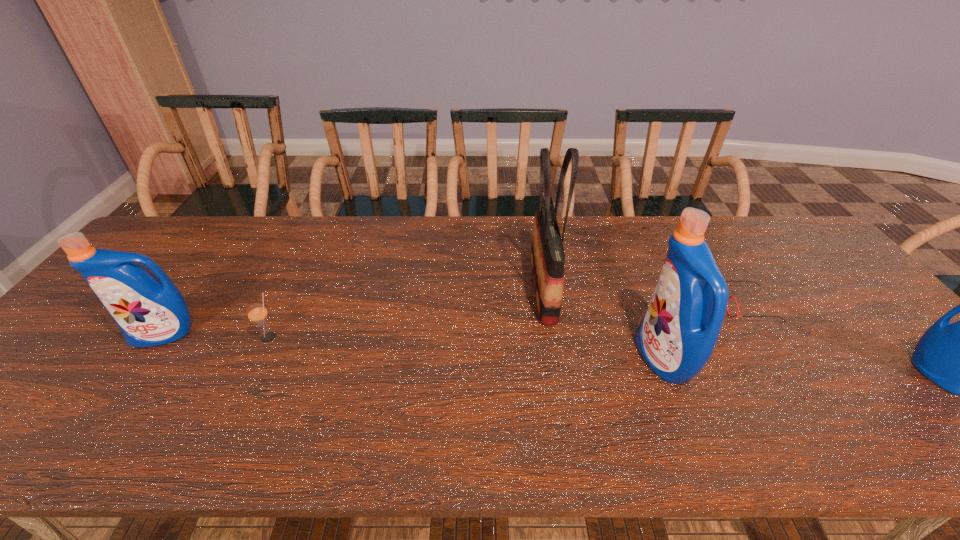
Find the location of a particular element. Image resolution: width=960 pixels, height=540 pixels. vacant spot for a new detergent to ensure equal spacing is located at coordinates (407, 347).